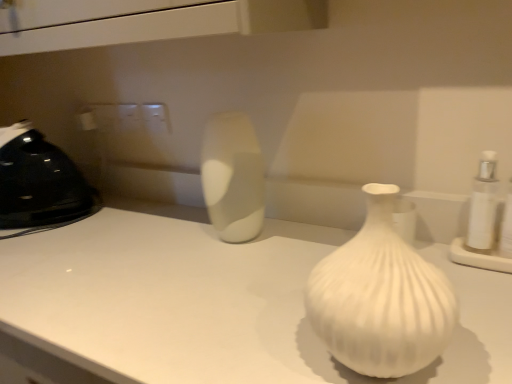
Question: From the image's perspective, is black plastic iron at left on satin white vase at center, the first vase from the back?

Choices:
 (A) no
 (B) yes

Answer: (B)

Question: Considering the relative positions of black plastic iron at left and satin white vase at center, which is the second vase from front to back, in the image provided, is black plastic iron at left behind satin white vase at center, which is the second vase from front to back,?

Choices:
 (A) yes
 (B) no

Answer: (A)

Question: Is black plastic iron at left to the right of satin white vase at center, the first vase from the back, from the viewer's perspective?

Choices:
 (A) yes
 (B) no

Answer: (B)

Question: Is black plastic iron at left wider than satin white vase at center, the first vase from the back?

Choices:
 (A) no
 (B) yes

Answer: (B)

Question: Is black plastic iron at left with satin white vase at center, which is the second vase from front to back?

Choices:
 (A) no
 (B) yes

Answer: (A)

Question: Is satin white vase at center, which is the second vase from front to back, located within black plastic iron at left?

Choices:
 (A) yes
 (B) no

Answer: (B)

Question: Can white matte counter top at center be found inside black plastic iron at left?

Choices:
 (A) yes
 (B) no

Answer: (B)

Question: From a real-world perspective, is black plastic iron at left under white matte counter top at center?

Choices:
 (A) no
 (B) yes

Answer: (A)

Question: Does black plastic iron at left have a larger size compared to white matte counter top at center?

Choices:
 (A) yes
 (B) no

Answer: (B)

Question: Would you consider black plastic iron at left to be distant from white matte counter top at center?

Choices:
 (A) no
 (B) yes

Answer: (A)

Question: Is black plastic iron at left next to white matte counter top at center and touching it?

Choices:
 (A) yes
 (B) no

Answer: (B)

Question: From a real-world perspective, is black plastic iron at left on top of white matte counter top at center?

Choices:
 (A) no
 (B) yes

Answer: (B)

Question: From a real-world perspective, is satin white vase at center, which is the second vase from front to back, over white ribbed vase at center, marked as the 2th vase in a back-to-front arrangement?

Choices:
 (A) no
 (B) yes

Answer: (B)